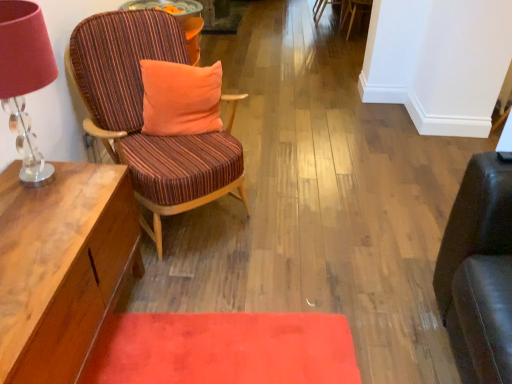
Question: From the image's perspective, is velvety red mat at lower center above or below translucent glass table lamp at left?

Choices:
 (A) above
 (B) below

Answer: (B)

Question: From a real-world perspective, is velvety red mat at lower center above or below translucent glass table lamp at left?

Choices:
 (A) below
 (B) above

Answer: (A)

Question: Which object is the farthest from the velvety red mat at lower center?

Choices:
 (A) striped fabric chair at left, marked as the first chair in a left-to-right arrangement
 (B) wooden chair with striped upholstery at center, placed as the 3th chair when sorted from front to back
 (C) translucent glass table lamp at left
 (D) wooden side table at left
 (E) striped fabric chair at upper center, the first chair positioned from the right

Answer: (B)

Question: Estimate the real-world distances between objects in this image. Which object is closer to the orange velvety pillow at center?

Choices:
 (A) velvety red mat at lower center
 (B) wooden side table at left
 (C) striped fabric chair at upper center, the second chair positioned from the bottom
 (D) wooden chair with striped upholstery at center, which is the first chair from top to bottom
 (E) translucent glass table lamp at left

Answer: (B)